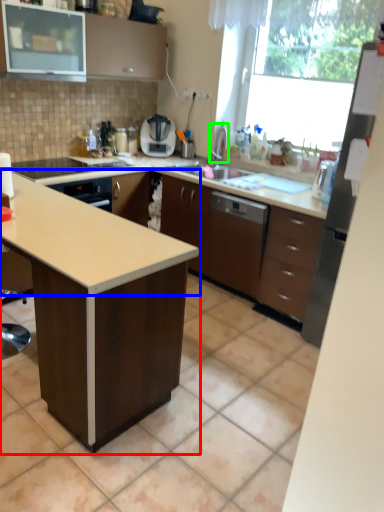
Question: Which object is positioned farthest from table (highlighted by a red box)? Select from countertop (highlighted by a blue box) and faucet (highlighted by a green box).

Choices:
 (A) countertop
 (B) faucet

Answer: (B)